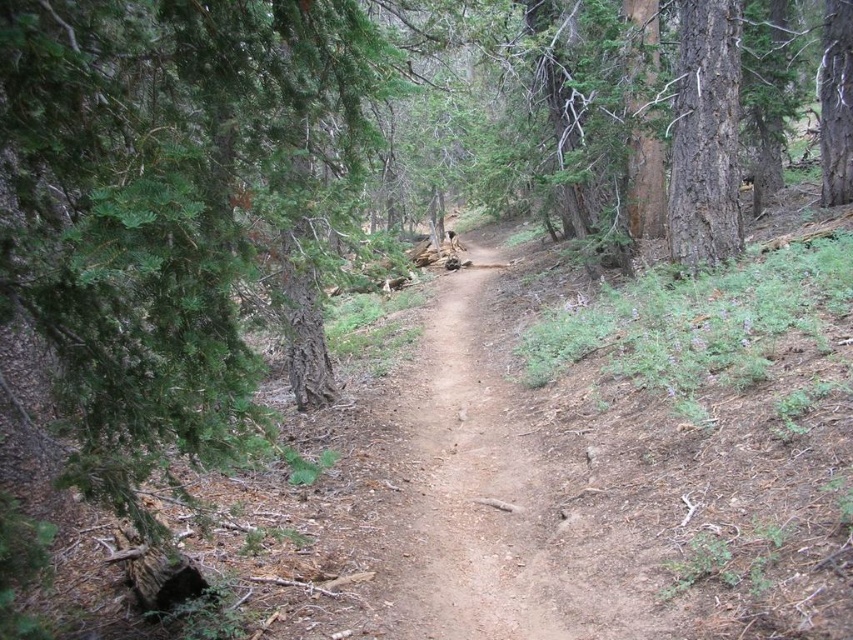
Question: Is dirt path at center wider than smooth brown tree trunk at right?

Choices:
 (A) no
 (B) yes

Answer: (B)

Question: Does dirt path at center appear over smooth brown tree trunk at right?

Choices:
 (A) yes
 (B) no

Answer: (B)

Question: Can you confirm if dirt path at center is positioned to the right of smooth brown tree trunk at right?

Choices:
 (A) yes
 (B) no

Answer: (B)